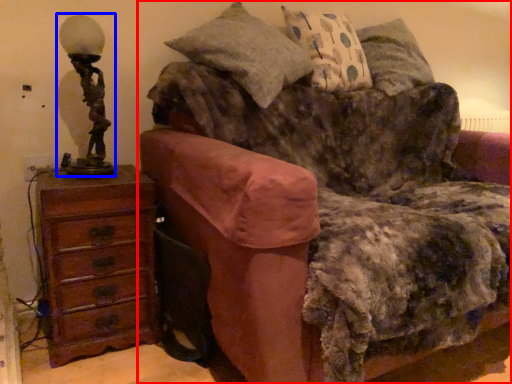
Question: Which point is further to the camera, studio couch (highlighted by a red box) or table lamp (highlighted by a blue box)?

Choices:
 (A) studio couch
 (B) table lamp

Answer: (B)